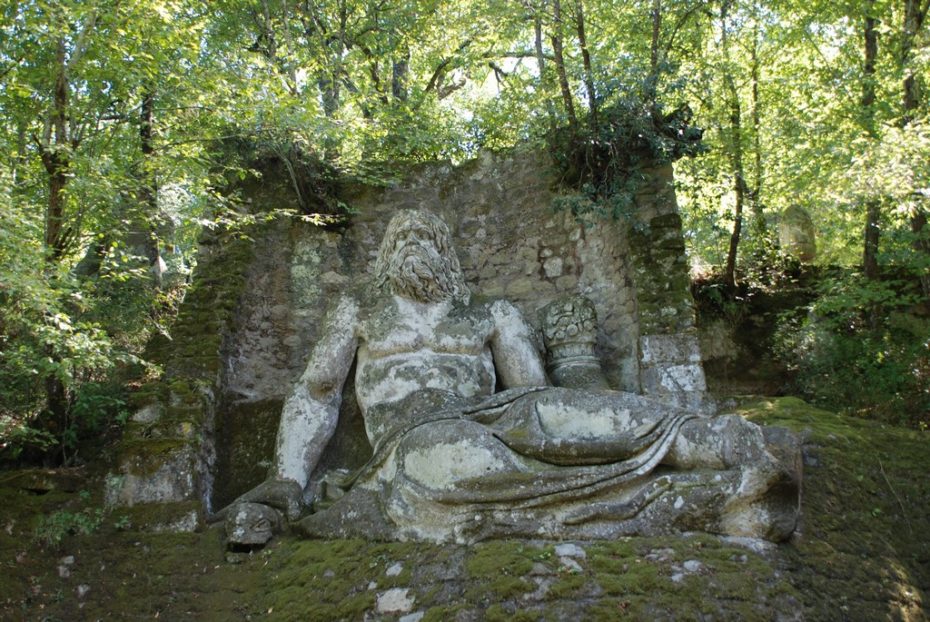
You are a GUI agent. You are given a task and a screenshot of the screen. Output one action in this format:
    pyautogui.click(x=<x>, y=<y>)
    Task: Click on the chest
    The image size is (930, 622).
    Given the screenshot: What is the action you would take?
    pyautogui.click(x=454, y=332)